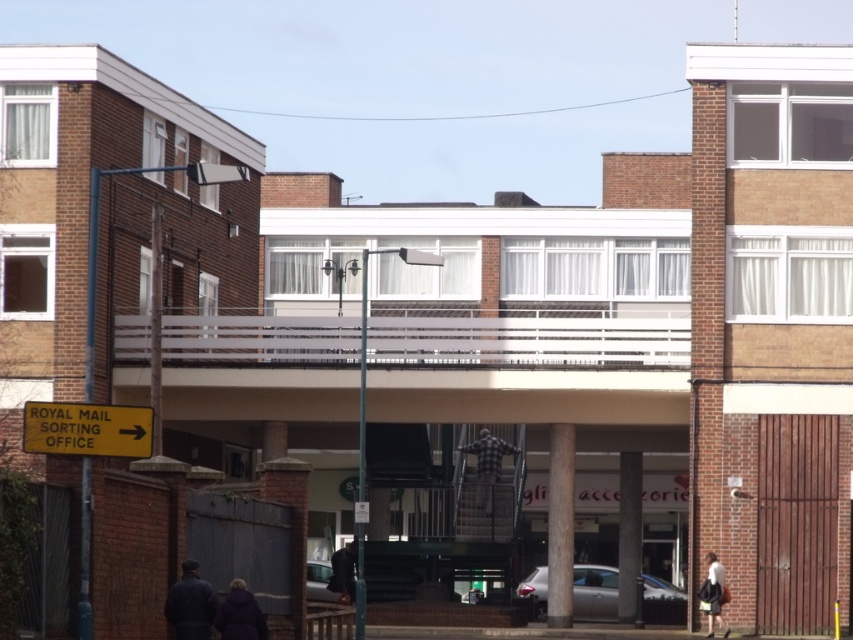
Does dark blue jacket at lower left have a larger size compared to purple fuzzy coat at lower center?

Correct, dark blue jacket at lower left is larger in size than purple fuzzy coat at lower center.

Can you confirm if dark blue jacket at lower left is positioned to the right of purple fuzzy coat at lower center?

In fact, dark blue jacket at lower left is to the left of purple fuzzy coat at lower center.

Between point (183, 586) and point (252, 625), which one is positioned behind?

Positioned behind is point (252, 625).

Locate an element on the screen. This screenshot has height=640, width=853. dark blue jacket at lower left is located at coordinates pos(190,604).

Can you confirm if dark gray concrete pillar at center is positioned below white cotton shirt at lower right?

Correct, dark gray concrete pillar at center is located below white cotton shirt at lower right.

Is point (627, 515) less distant than point (712, 584)?

No, it is not.

Between point (631, 531) and point (712, 582), which one is positioned in front?

Positioned in front is point (712, 582).

This screenshot has height=640, width=853. In order to click on dark gray concrete pillar at center in this screenshot , I will do `click(630, 536)`.

Based on the photo, is purple fuzzy coat at lower center positioned in front of dark brown leather jacket at center?

Yes.

Can you confirm if purple fuzzy coat at lower center is positioned to the left of dark brown leather jacket at center?

In fact, purple fuzzy coat at lower center is to the right of dark brown leather jacket at center.

Where is `purple fuzzy coat at lower center`? The image size is (853, 640). purple fuzzy coat at lower center is located at coordinates (241, 614).